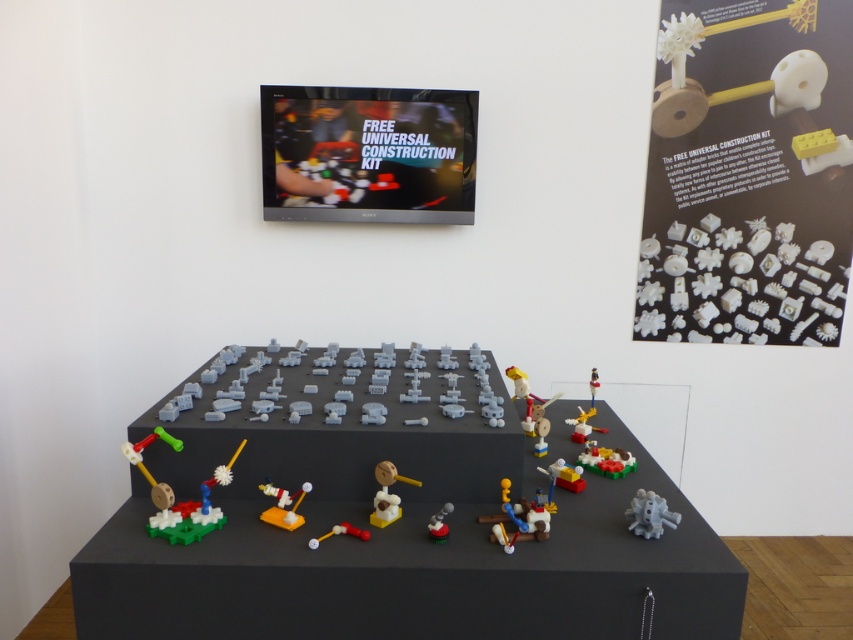
Question: From the image, what is the correct spatial relationship of wooden hammer at center in relation to translucent white plastic rocket at center?

Choices:
 (A) below
 (B) above

Answer: (B)

Question: Which point is closer to the camera?

Choices:
 (A) translucent yellow toy at center
 (B) white plastic gears at upper right

Answer: (A)

Question: Is matte gray toy at center to the right of translucent yellow rod at center from the viewer's perspective?

Choices:
 (A) no
 (B) yes

Answer: (B)

Question: Does matte plastic table at center appear on the right side of gray matte octopus at lower right?

Choices:
 (A) no
 (B) yes

Answer: (A)

Question: Which point is closer to the camera?

Choices:
 (A) [x=561, y=483]
 (B) [x=683, y=305]
 (C) [x=236, y=406]

Answer: (C)

Question: Estimate the real-world distances between objects in this image. Which object is closer to the translucent yellow toy at center?

Choices:
 (A) translucent white plastic rocket at center
 (B) white plastic gears at upper right
 (C) gray matte octopus at lower right
 (D) matte gray toy at center

Answer: (C)